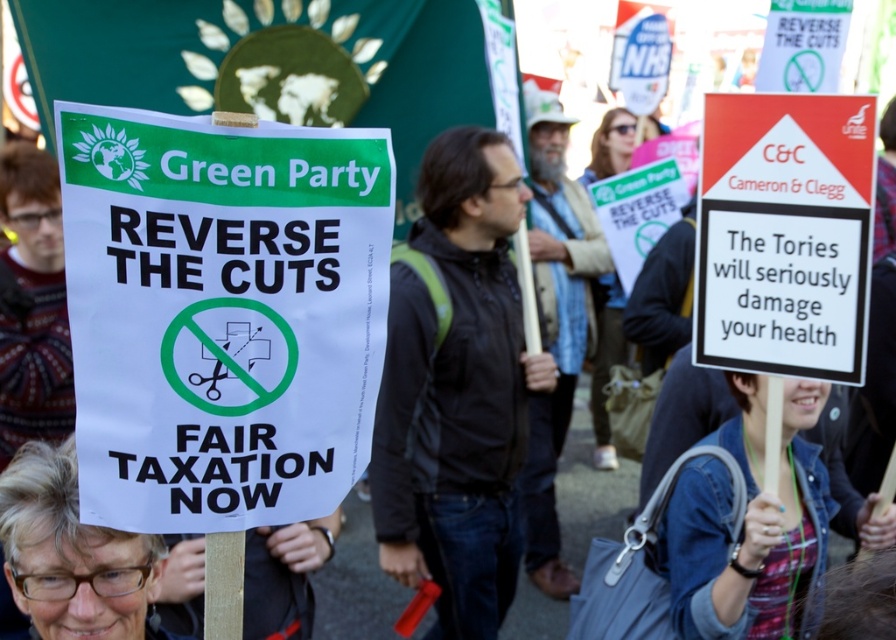
What is located at the point with coordinates (x=221, y=314) in the protest scene?

The point with coordinates (x=221, y=314) is located on the white paper sign at center.

You are a photographer standing in the protest area. You want to take a photo of the white paper sign at center and the black jacket at center. Based on their sizes in the image, which object appears taller?

The black jacket at center appears taller than the white paper sign at center because the white paper sign at center is not as tall as the black jacket at center.

You are a photographer trying to capture the protest scene. You notice the white paper sign at center and the black jacket at center. Which object is positioned closer to your camera lens?

The white paper sign at center is closer to the viewer than the black jacket at center, so the sign will appear closer to the camera lens.